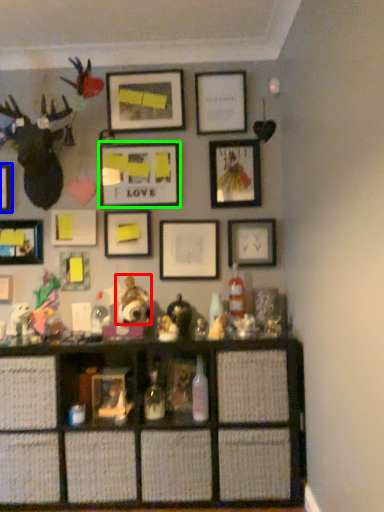
Question: Which object is positioned farthest from toy (highlighted by a red box)? Select from picture frame (highlighted by a blue box) and picture frame (highlighted by a green box).

Choices:
 (A) picture frame
 (B) picture frame

Answer: (A)